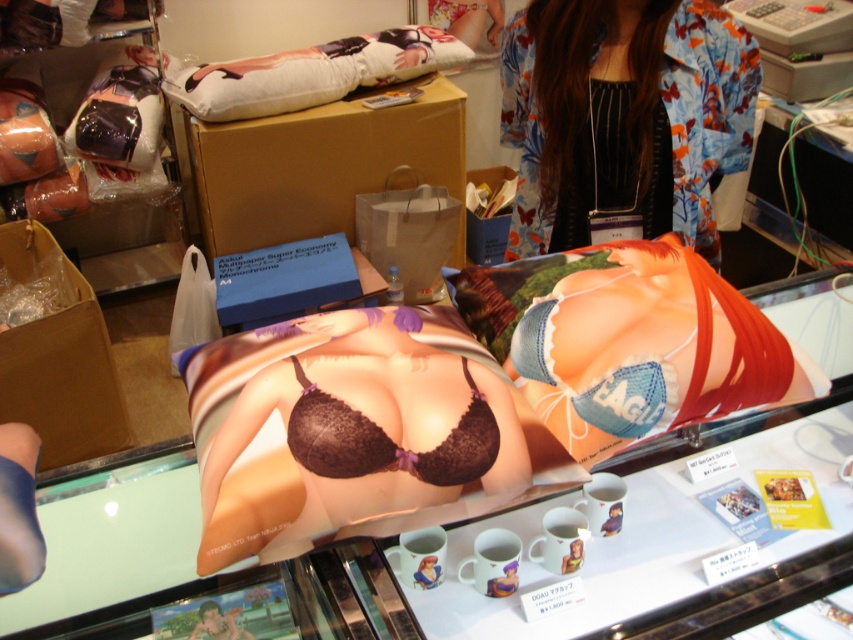
Is floral kimono at upper center positioned behind lace dark brown bikini top at center?

Yes, it is.

Is floral kimono at upper center below lace dark brown bikini top at center?

Incorrect, floral kimono at upper center is not positioned below lace dark brown bikini top at center.

Between point (633, 131) and point (370, 464), which one is positioned in front?

Point (370, 464) is in front.

Locate an element on the screen. This screenshot has height=640, width=853. floral kimono at upper center is located at coordinates (624, 116).